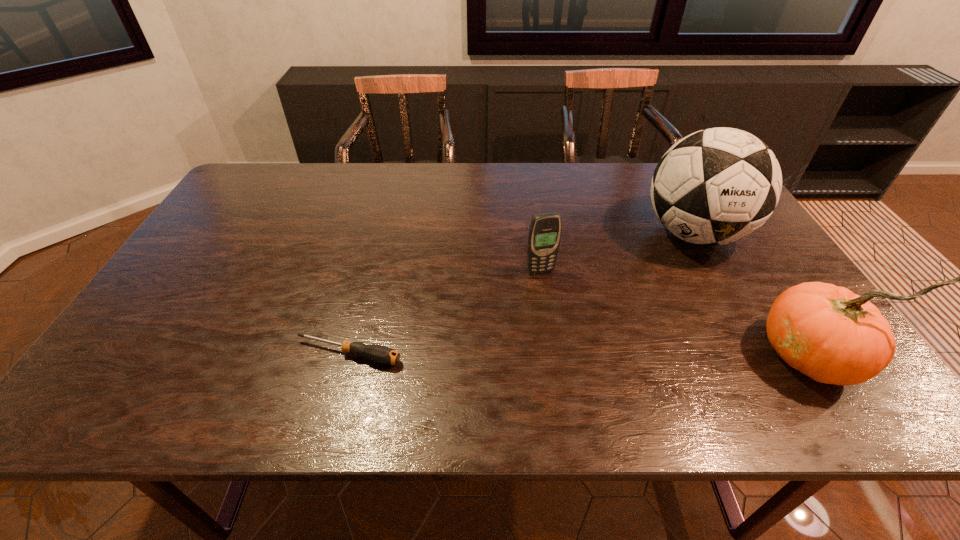
Find the location of `screwdriver`. screwdriver is located at coordinates tap(380, 354).

I want to click on the shortest object, so click(x=380, y=354).

The width and height of the screenshot is (960, 540). What are the coordinates of `pumpkin` in the screenshot? It's located at (827, 332).

Image resolution: width=960 pixels, height=540 pixels. In order to click on soccer ball in this screenshot , I will do `click(719, 185)`.

Locate an element on the screen. The image size is (960, 540). the third object from right to left is located at coordinates (545, 230).

The width and height of the screenshot is (960, 540). I want to click on cellular telephone, so click(545, 230).

Locate an element on the screen. The height and width of the screenshot is (540, 960). vacant point located on the right of the shortest object is located at coordinates (501, 354).

Where is `vacant space situated on the back of the pumpkin`? The image size is (960, 540). vacant space situated on the back of the pumpkin is located at coordinates (743, 250).

This screenshot has height=540, width=960. I want to click on free point located 0.260m on the surface of the soccer ball where the brand logo is visible, so click(x=628, y=315).

The image size is (960, 540). Identify the location of vacant space situated on the surface of the soccer ball where the brand logo is visible. (622, 322).